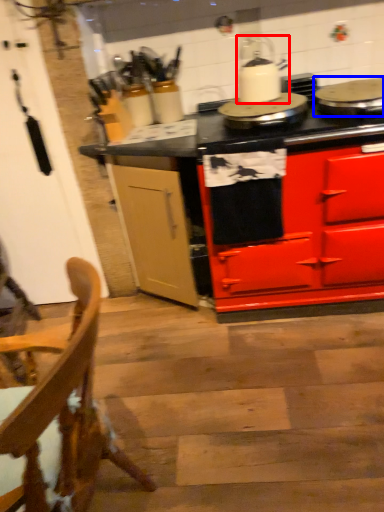
Question: Among these objects, which one is farthest to the camera, kitchen appliance (highlighted by a red box) or appliance (highlighted by a blue box)?

Choices:
 (A) kitchen appliance
 (B) appliance

Answer: (A)